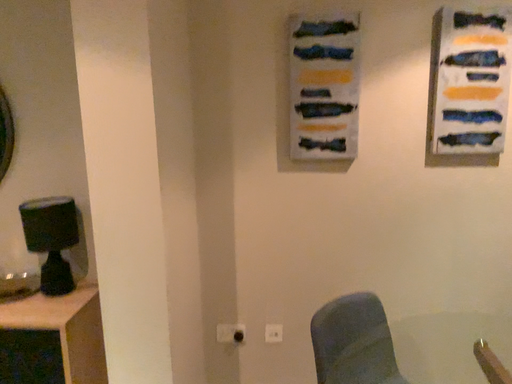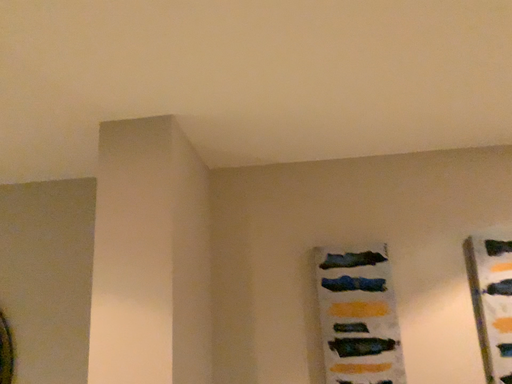
Question: Which way did the camera rotate in the video?

Choices:
 (A) rotated downward
 (B) rotated upward

Answer: (B)